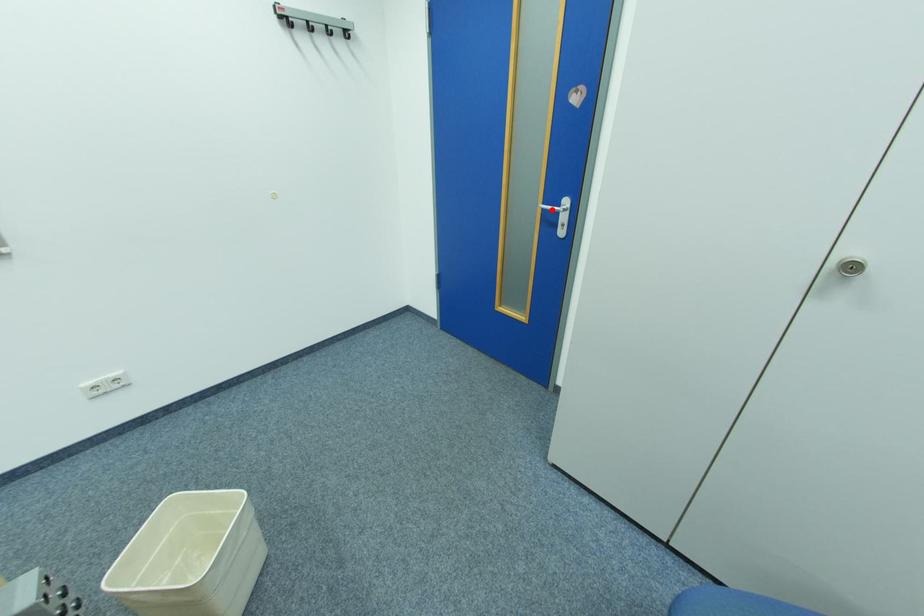
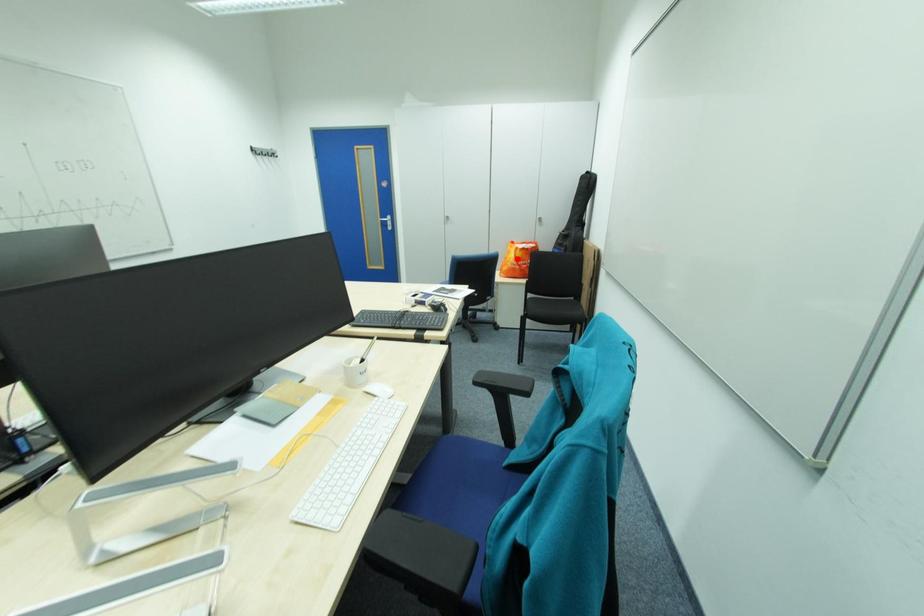
I am providing you with two images of the same scene from different viewpoints. A red point is marked on the first image and another point is marked on the second image. Are the points marked in image1 and image2 representing the same 3D position?

No